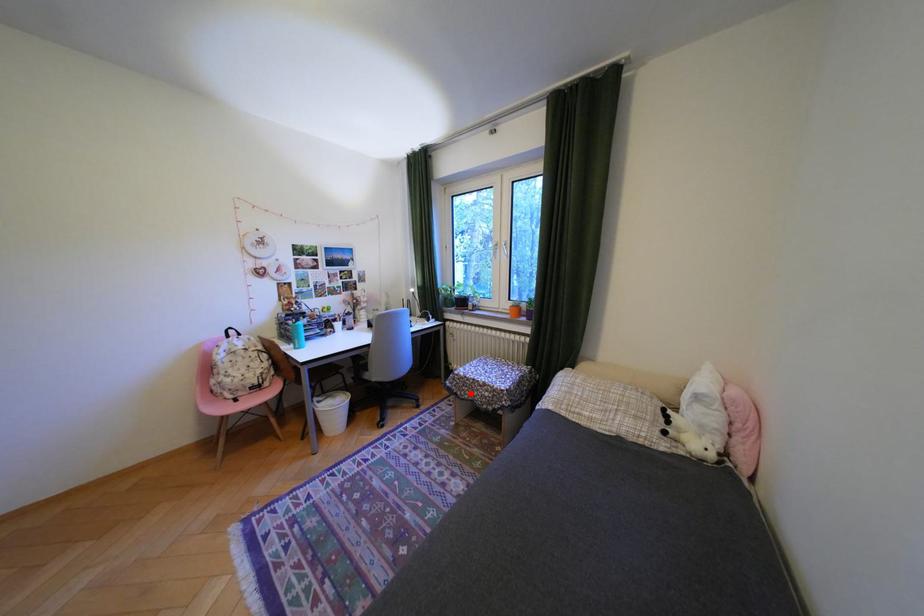
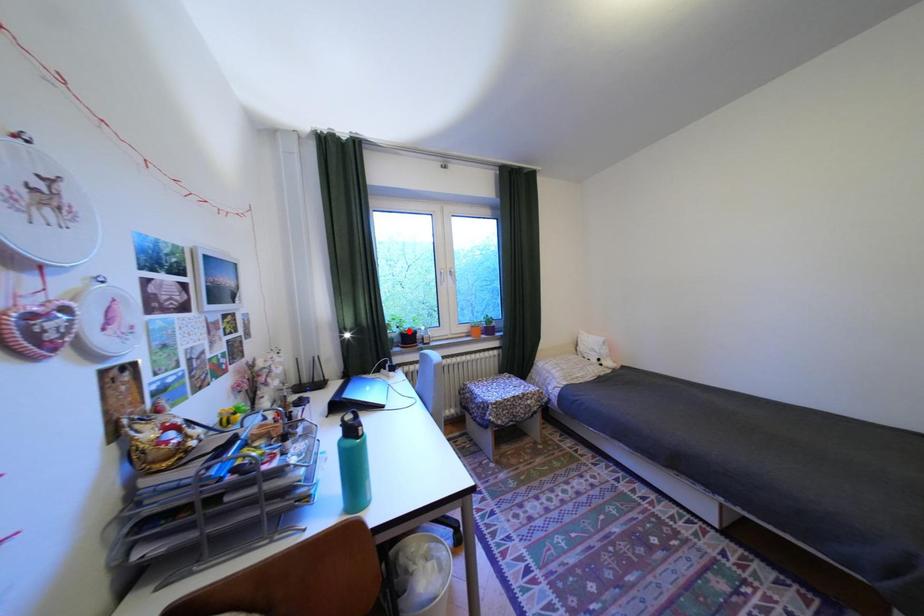
I am providing you with two images of the same scene from different viewpoints. A red point is marked on the first image and another point is marked on the second image. Do the highlighted points in image1 and image2 indicate the same real-world spot?

No